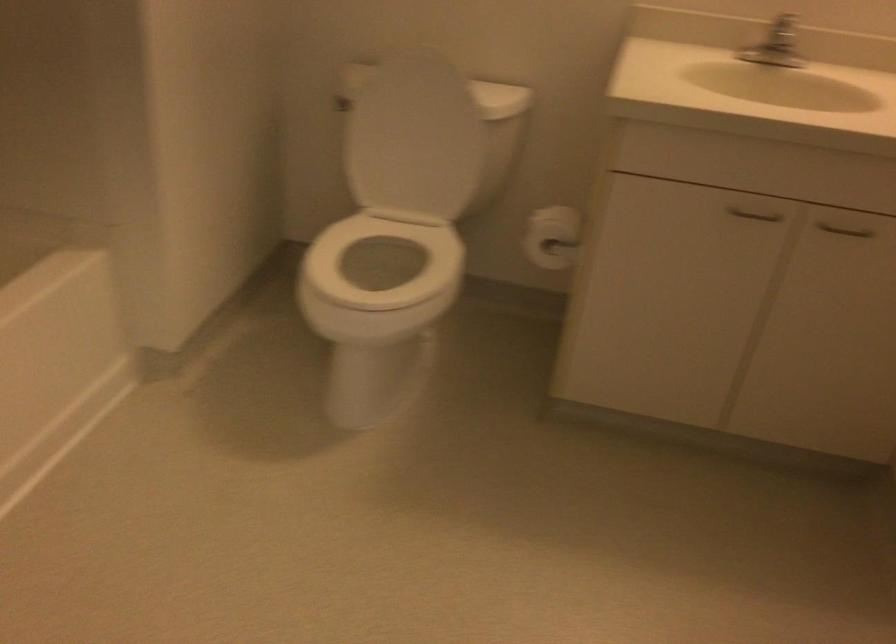
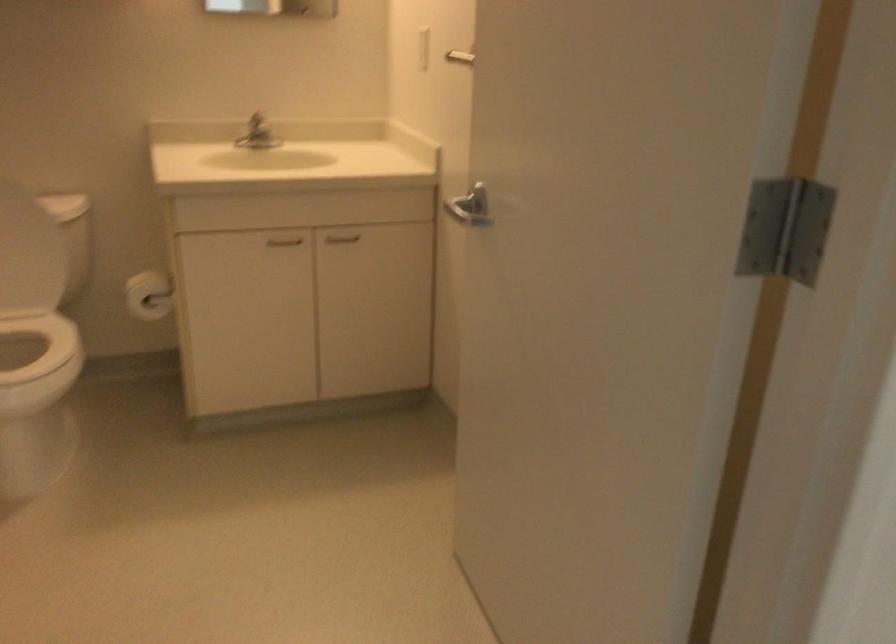
Question: The camera is either moving clockwise (left) or counter-clockwise (right) around the object. The first image is from the beginning of the video and the second image is from the end. Is the camera moving left or right when shooting the video?

Choices:
 (A) Left
 (B) Right

Answer: (A)